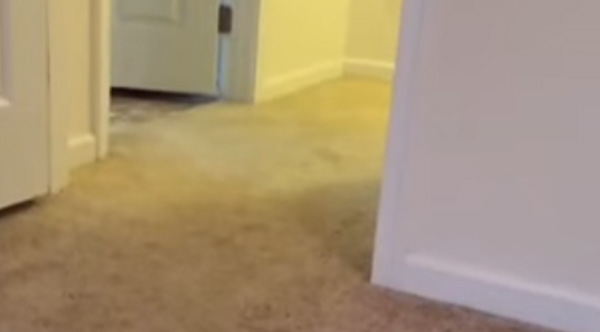
Find the location of a particular element. The image size is (600, 332). wall is located at coordinates (498, 156).